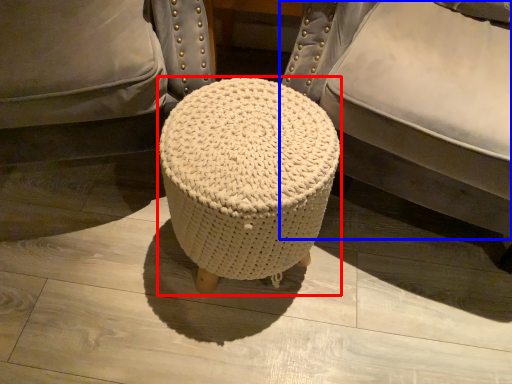
Question: Which point is closer to the camera, stool (highlighted by a red box) or furniture (highlighted by a blue box)?

Choices:
 (A) stool
 (B) furniture

Answer: (B)